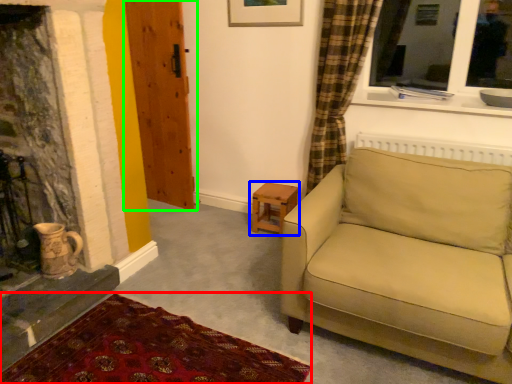
Question: Which is farther away from plain (highlighted by a red box)? table (highlighted by a blue box) or door (highlighted by a green box)?

Choices:
 (A) table
 (B) door

Answer: (B)